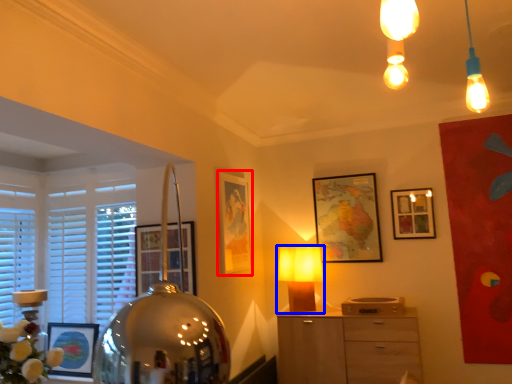
Question: Which point is further to the camera, picture frame (highlighted by a red box) or lamp (highlighted by a blue box)?

Choices:
 (A) picture frame
 (B) lamp

Answer: (B)